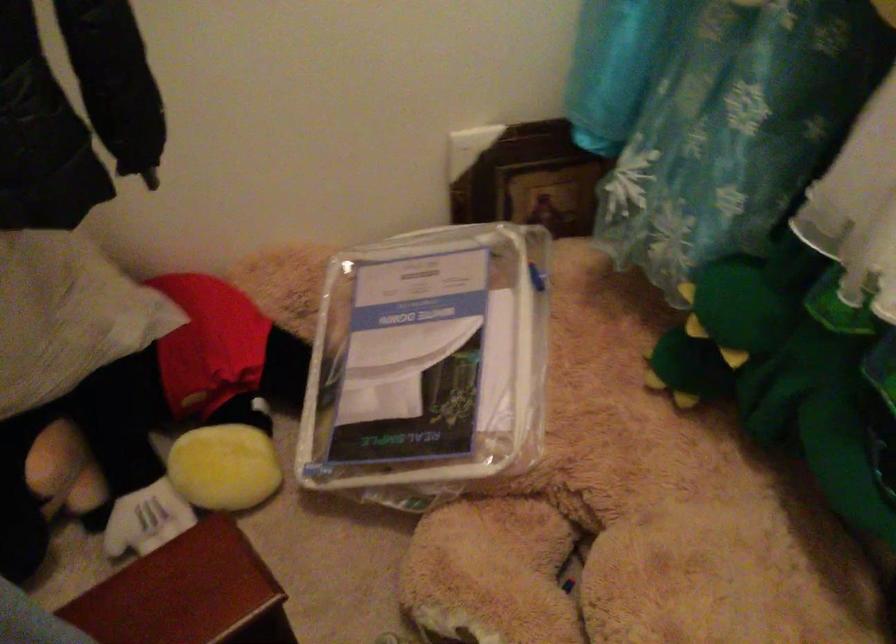
Locate an element on the screen. The height and width of the screenshot is (644, 896). packaged bedding is located at coordinates (427, 365).